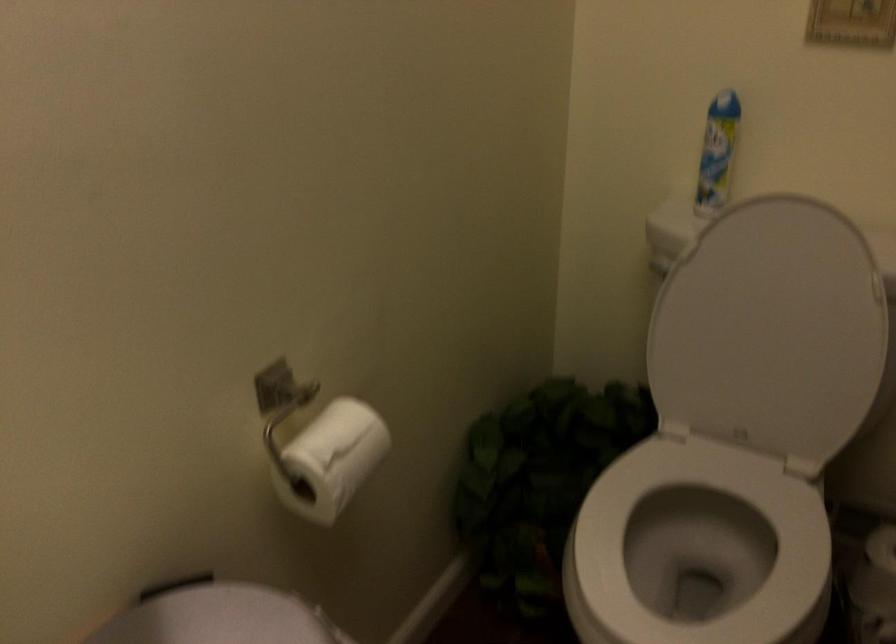
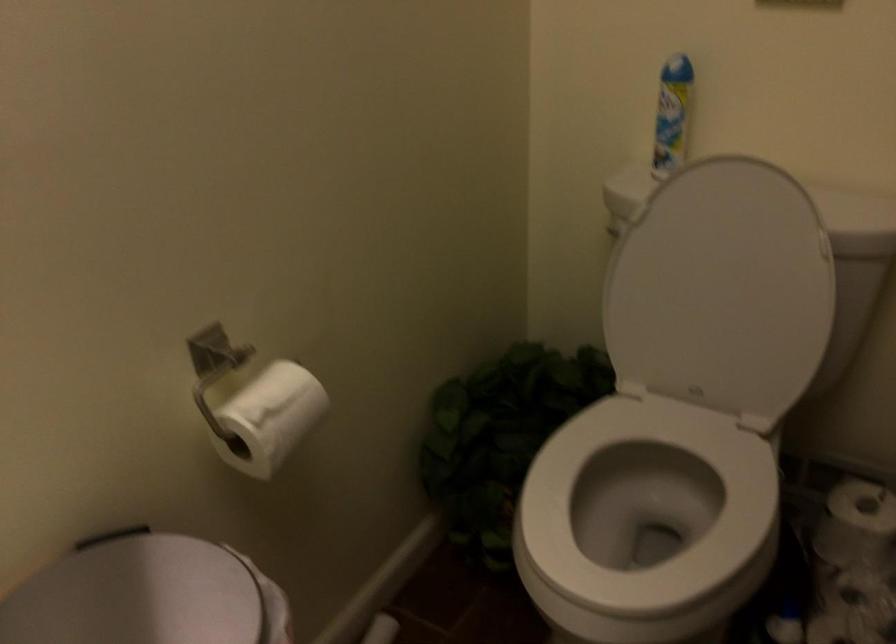
In the second image, find the point that corresponds to [334,462] in the first image.

(271, 417)